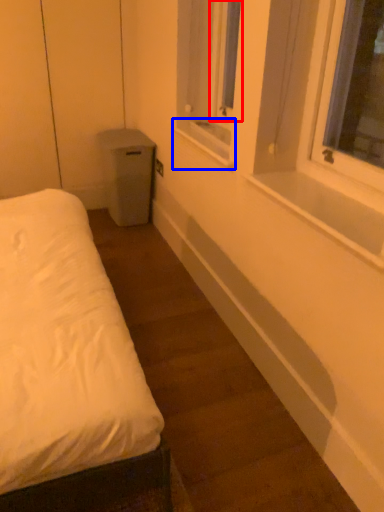
Question: Which of the following is the closest to the observer, window screen (highlighted by a red box) or window sill (highlighted by a blue box)?

Choices:
 (A) window screen
 (B) window sill

Answer: (B)